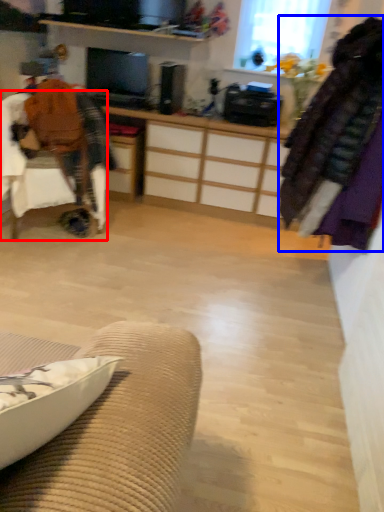
Question: Which point is closer to the camera, chair (highlighted by a red box) or clothing (highlighted by a blue box)?

Choices:
 (A) chair
 (B) clothing

Answer: (B)